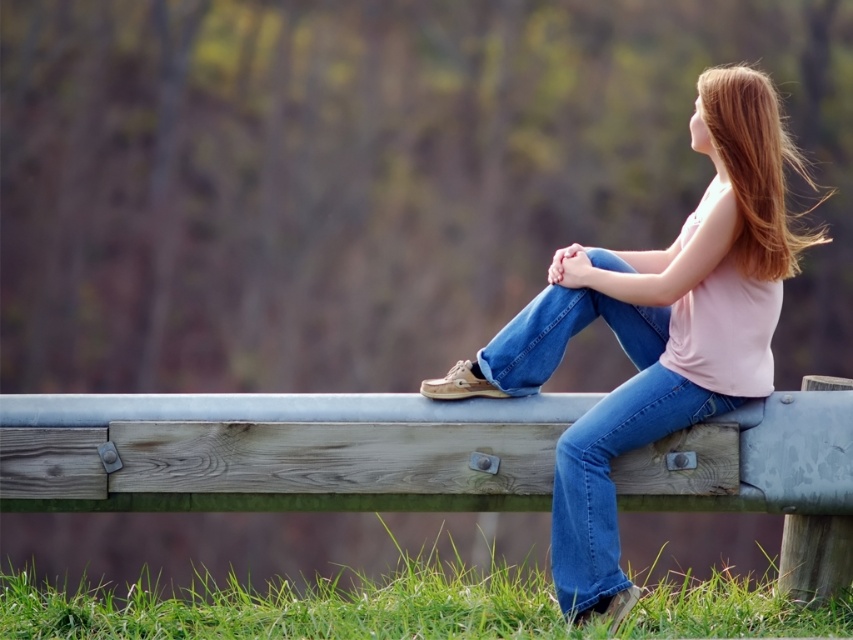
You are a fashion designer analyzing the clothing items in the image. Which clothing item, the matte pink tank top at center or the denim at center, has a bigger size?

The matte pink tank top at center is larger in size than the denim at center.

You are standing in the scene and want to place a small flag at the point that is closer to you. Which point should you choose between point (700, 144) and point (782, 266)?

Point (700, 144) is closer to you than point (782, 266) because it is further to the camera.